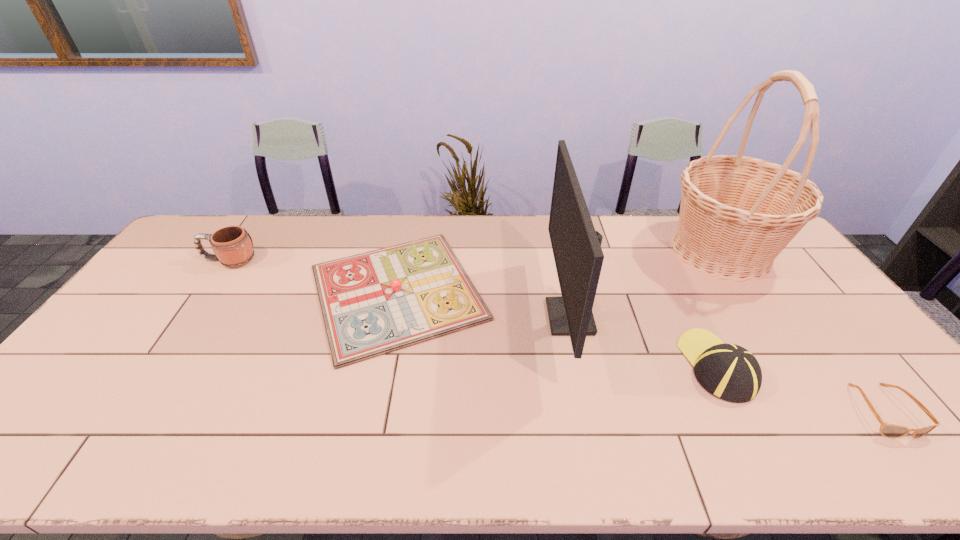
Find the location of a particular element. The image size is (960, 540). gameboard that is at the far edge is located at coordinates (373, 303).

This screenshot has height=540, width=960. I want to click on object that is positioned at the near edge, so click(887, 430).

I want to click on object located at the left edge, so coord(232,245).

At what (x,y) coordinates should I click in order to perform the action: click on basket that is positioned at the right edge. Please return your answer as a coordinate pair (x, y). Looking at the image, I should click on (737, 213).

Locate an element on the screen. The height and width of the screenshot is (540, 960). sunglasses situated at the right edge is located at coordinates (887, 430).

Locate an element on the screen. The image size is (960, 540). object present at the far left corner is located at coordinates (232, 245).

Find the location of `object positioned at the far right corner`. object positioned at the far right corner is located at coordinates (737, 213).

Where is `object positioned at the near right corner`? This screenshot has height=540, width=960. object positioned at the near right corner is located at coordinates click(x=887, y=430).

The image size is (960, 540). I want to click on vacant space at the far edge of the desktop, so click(x=379, y=245).

Identify the location of vacant area at the near edge. This screenshot has width=960, height=540. (118, 463).